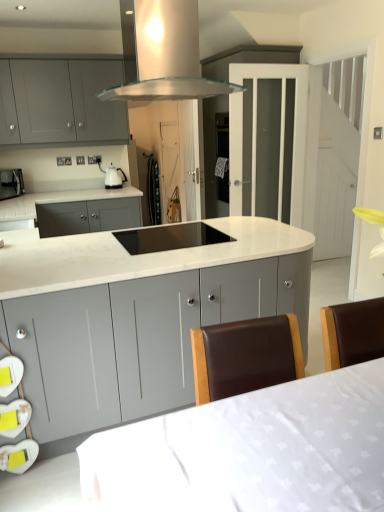
Find the location of a particular element. free spot above black glass cooktop at center (from a real-world perspective) is located at coordinates (177, 234).